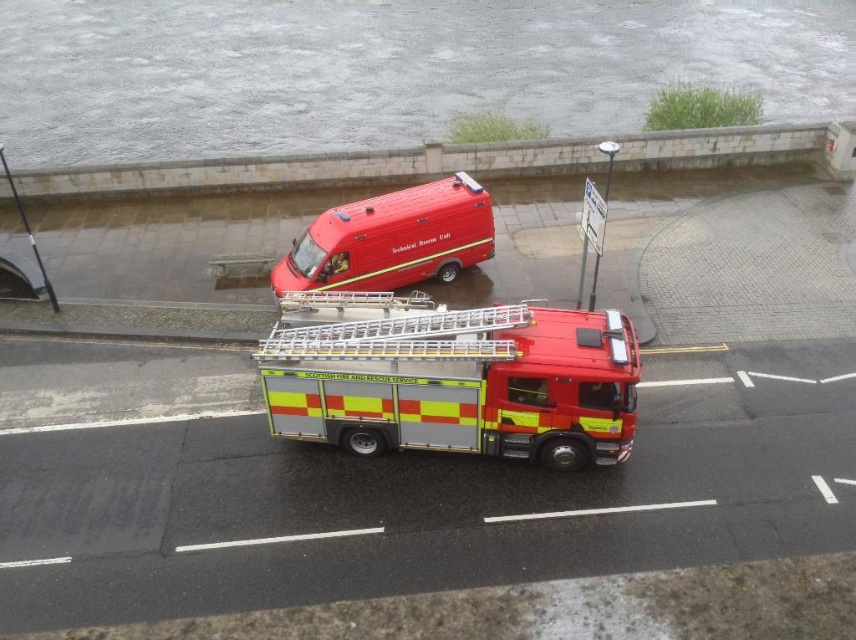
Question: Which point appears closest to the camera in this image?

Choices:
 (A) (791, 90)
 (B) (473, 164)

Answer: (B)

Question: Does white stone curb at upper center appear under matte red van at center?

Choices:
 (A) no
 (B) yes

Answer: (A)

Question: Which object is closer to the camera taking this photo?

Choices:
 (A) white stone curb at upper center
 (B) gray concrete flood at upper center

Answer: (A)

Question: Which point is closer to the camera?

Choices:
 (A) matte red van at center
 (B) gray concrete flood at upper center

Answer: (A)

Question: Can you confirm if metallic red fire truck at center is smaller than matte red van at center?

Choices:
 (A) no
 (B) yes

Answer: (B)

Question: Does metallic red fire truck at center appear under white stone curb at upper center?

Choices:
 (A) no
 (B) yes

Answer: (B)